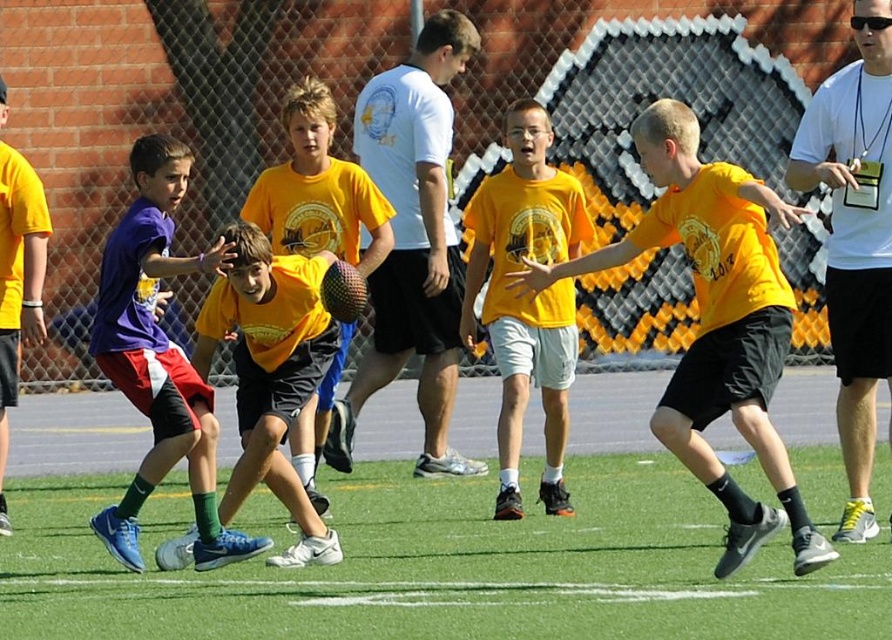
Question: Which object is farther from the camera taking this photo?

Choices:
 (A) matte yellow shirt at center
 (B) purple matte shirt at left

Answer: (A)

Question: Is white matte shirt at center positioned at the back of white t-shirt at upper right?

Choices:
 (A) yes
 (B) no

Answer: (A)

Question: Is green artificial turf at center wider than white t-shirt at upper right?

Choices:
 (A) no
 (B) yes

Answer: (B)

Question: Does matte yellow jersey at center have a greater width compared to matte yellow shirt at center?

Choices:
 (A) yes
 (B) no

Answer: (B)

Question: Considering the real-world distances, which object is farthest from the yellow matte shirt at center?

Choices:
 (A) green artificial turf at center
 (B) white t-shirt at upper right

Answer: (A)

Question: Considering the real-world distances, which object is farthest from the purple matte shirt at left?

Choices:
 (A) white matte shirt at center
 (B) white t-shirt at upper right

Answer: (B)